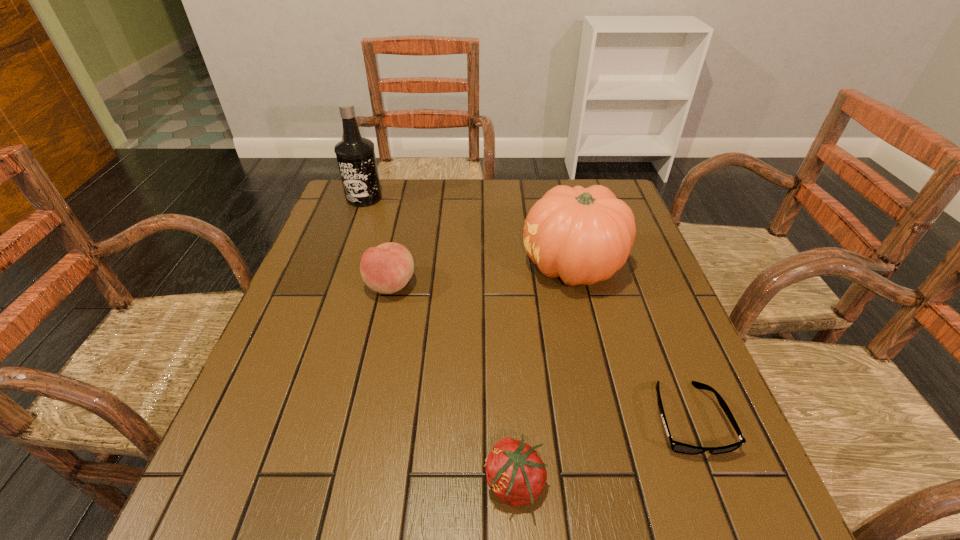
Image resolution: width=960 pixels, height=540 pixels. In order to click on vacant space at the far edge in this screenshot , I will do `click(444, 214)`.

Locate an element on the screen. This screenshot has height=540, width=960. free space at the near edge of the desktop is located at coordinates (458, 497).

The image size is (960, 540). Identify the location of vacant space at the left edge. (313, 368).

I want to click on vacant space at the right edge of the desktop, so click(x=624, y=357).

Image resolution: width=960 pixels, height=540 pixels. What are the coordinates of `free space at the far left corner` in the screenshot? It's located at (342, 206).

Find the location of `vacant point located between the pumpkin and the fourth object from right to left`. vacant point located between the pumpkin and the fourth object from right to left is located at coordinates (482, 275).

This screenshot has width=960, height=540. What are the coordinates of `free area in between the peach and the tallest object` in the screenshot? It's located at (377, 241).

Identify the location of free space between the tallest object and the second shortest object. (440, 341).

Where is `vacant space that is in between the fourth tallest object and the sunglasses`? Image resolution: width=960 pixels, height=540 pixels. vacant space that is in between the fourth tallest object and the sunglasses is located at coordinates (601, 451).

At what (x,y) coordinates should I click in order to perform the action: click on vacant area that lies between the pumpkin and the sunglasses. Please return your answer as a coordinate pair (x, y). Looking at the image, I should click on (631, 342).